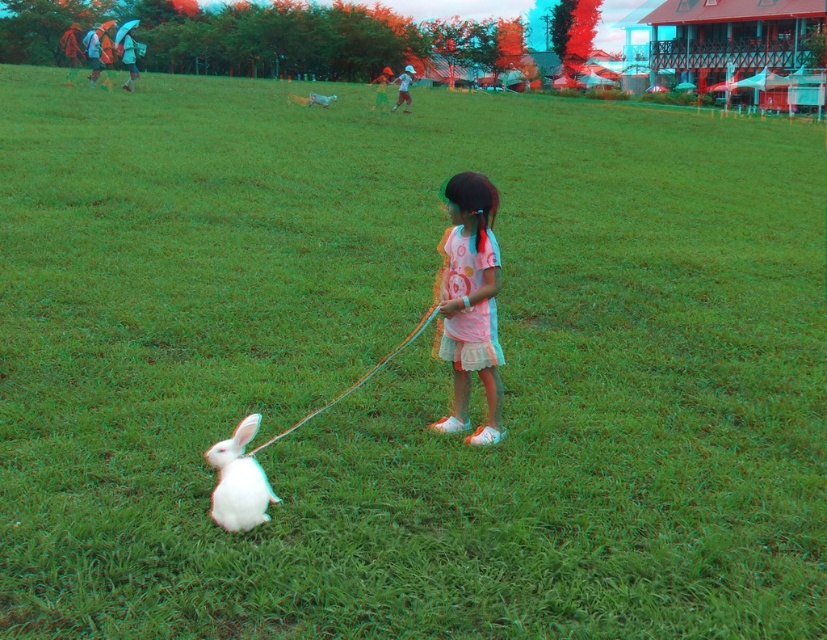
What do you see at coordinates (471, 301) in the screenshot? I see `pink cotton dress at center` at bounding box center [471, 301].

Looking at this image, is pink cotton dress at center positioned at the back of white fluffy rabbit at lower left?

Yes, it is behind white fluffy rabbit at lower left.

Is point (485, 224) farther from camera compared to point (251, 424)?

That is True.

Where is `pink cotton dress at center`? pink cotton dress at center is located at coordinates 471,301.